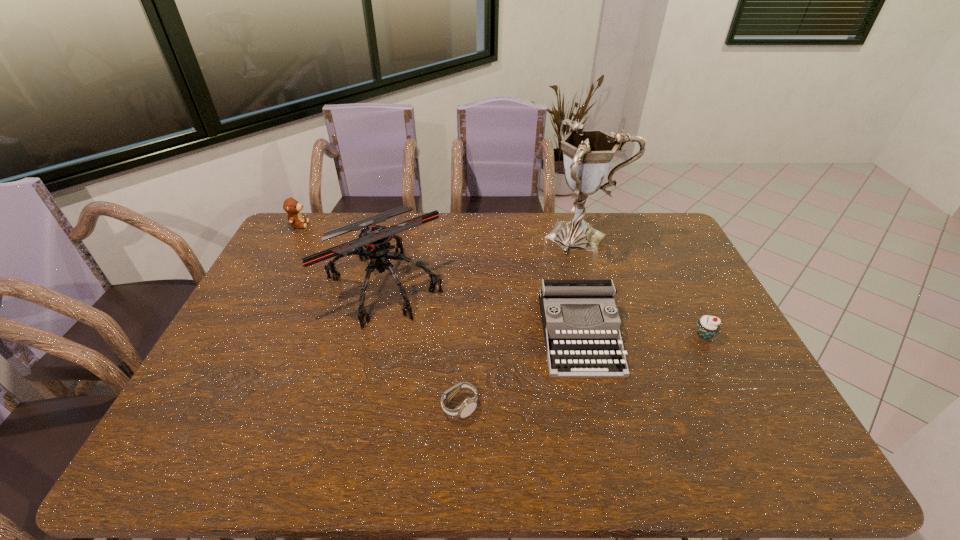
In order to click on vacant space at the near edge in this screenshot , I will do `click(390, 441)`.

This screenshot has height=540, width=960. In order to click on vacant space at the left edge of the desktop in this screenshot , I will do `click(184, 406)`.

At what (x,y) coordinates should I click in order to perform the action: click on vacant space at the right edge of the desktop. Please return your answer as a coordinate pair (x, y). This screenshot has width=960, height=540. Looking at the image, I should click on (712, 348).

What are the coordinates of `vacant space at the far left corner` in the screenshot? It's located at (313, 238).

Where is `blank space at the near left corner of the desktop`? blank space at the near left corner of the desktop is located at coordinates (216, 457).

Where is `free space between the shortest object and the tallest object`? free space between the shortest object and the tallest object is located at coordinates (521, 321).

In order to click on empty space that is in between the typewriter and the shortest object in this screenshot , I will do [x=519, y=370].

Locate an element on the screen. This screenshot has width=960, height=540. empty space between the cupcake and the teddy bear is located at coordinates (502, 280).

This screenshot has width=960, height=540. Identify the location of free space between the cupcake and the trophy cup. (644, 285).

You are a GUI agent. You are given a task and a screenshot of the screen. Output one action in this format:
    pyautogui.click(x=<x>, y=<y>)
    Task: Click on the empty location between the rightmost object and the typewriter
    The width and height of the screenshot is (960, 540).
    Given the screenshot: What is the action you would take?
    pyautogui.click(x=642, y=335)